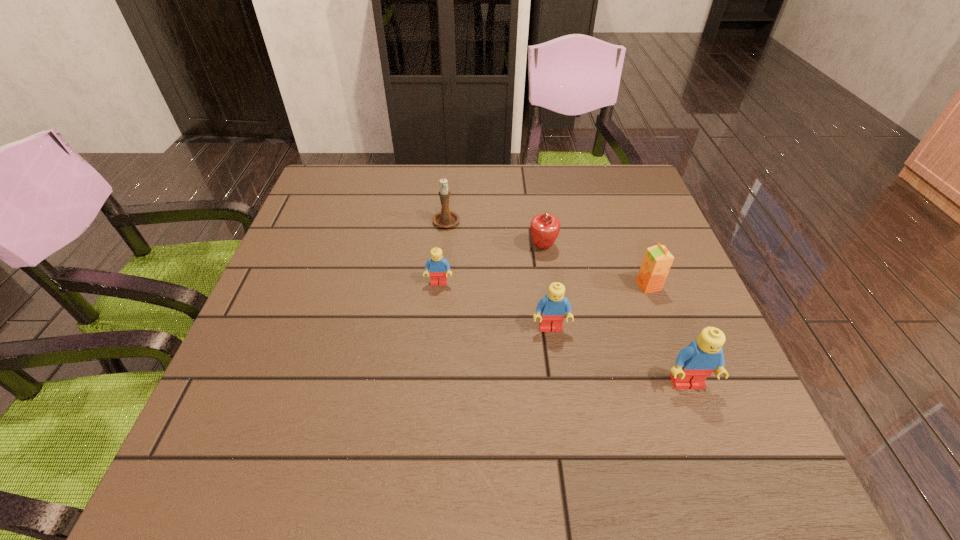
Where is `object located at the near right corner`? This screenshot has width=960, height=540. object located at the near right corner is located at coordinates (694, 363).

At what (x,y) coordinates should I click in order to perform the action: click on free region at the far edge of the desktop. Please return your answer as a coordinate pair (x, y). This screenshot has height=540, width=960. Looking at the image, I should click on (576, 193).

The width and height of the screenshot is (960, 540). In the image, there is a desktop. Identify the location of vacant space at the near edge. (479, 386).

The image size is (960, 540). What are the coordinates of `vacant space at the left edge of the desktop` in the screenshot? It's located at (343, 225).

Locate an element on the screen. Image resolution: width=960 pixels, height=540 pixels. vacant space at the right edge of the desktop is located at coordinates (646, 232).

Locate an element on the screen. The image size is (960, 540). vacant space at the far left corner of the desktop is located at coordinates (333, 180).

Where is `free spot at the near left corner of the desktop`? This screenshot has height=540, width=960. free spot at the near left corner of the desktop is located at coordinates (281, 410).

Locate an element on the screen. Image resolution: width=960 pixels, height=540 pixels. vacant area that lies between the candle holder and the shortest Lego is located at coordinates (443, 251).

Where is `vacant space in between the orange juice and the second Lego from right to left`? vacant space in between the orange juice and the second Lego from right to left is located at coordinates (599, 307).

Find the location of `free space between the apple and the orange juice`. free space between the apple and the orange juice is located at coordinates tap(595, 266).